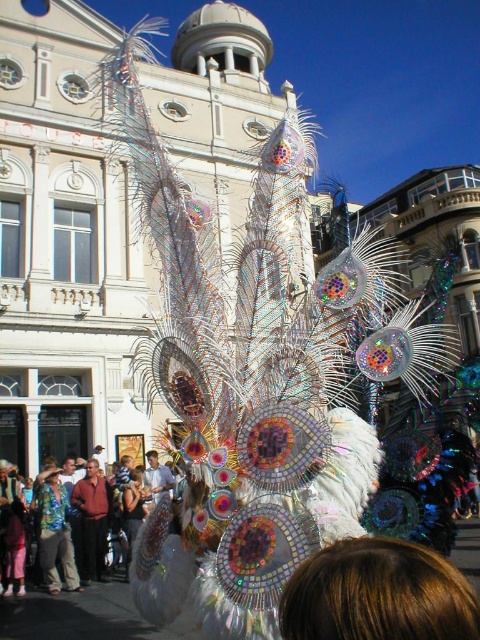
You are a photographer standing at the center of the street, and you want to capture the brown hair at lower center in your photo. Based on its position, where should you aim your camera?

The brown hair at lower center is located at point 0.930 on the x axis and 0.787 on the y axis, so you should aim your camera towards the lower right side of the frame to capture it.

You are standing in the middle of the street during the parade. There is a float with metallic peacock feathers in front of you. Behind the float, you see a historic building with arched windows. You also notice a person with brown hair at lower center. If you want to take a photo of the historic building, should you move closer to or farther away from the float with metallic peacock feathers?

To take a photo of the historic building behind the float with metallic peacock feathers, you should move farther away from the float. This will help reduce the obstruction caused by the float between you and the building.

You are standing at the center of the street and see two points marked on the float. One is at point (469, 588) and the other is at point (87, 515). Which point is closer to you?

Point (469, 588) is in front of point (87, 515), so it is closer to you.